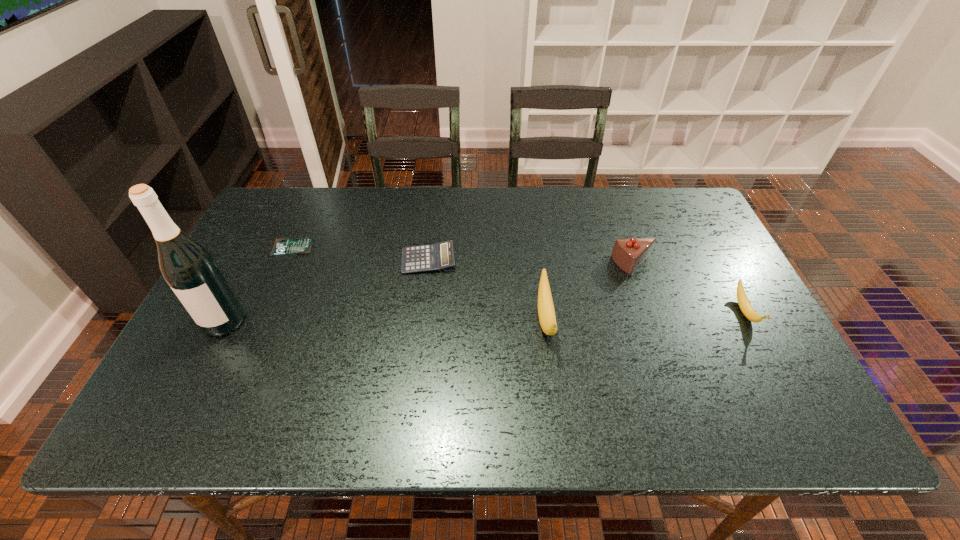
All bananas are currently evenly spaced. To continue this pattern, where would you add another banana on the left? Please point out a vacant spot. Please provide its 2D coordinates. Your answer should be formatted as a tuple, i.e. [(x, y)], where the tuple contains the x and y coordinates of a point satisfying the conditions above.

[(342, 326)]